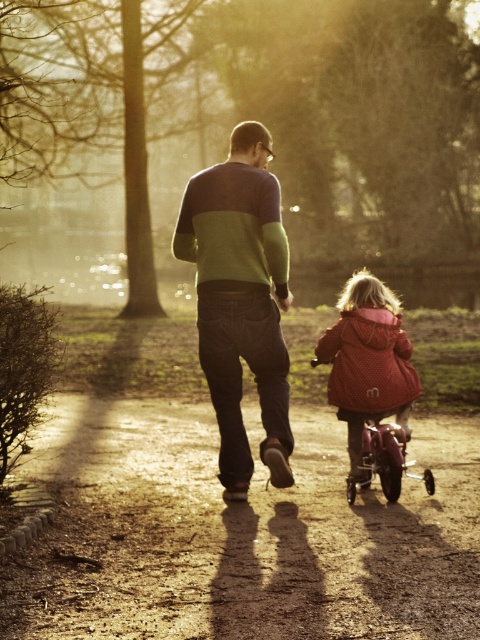
You are standing in the middle of the dirt path and see two points marked on the ground. The first point is at coordinates point (240, 250) and the second point is at point (355, 296). Which point is closer to you?

Point (240, 250) is closer to the viewer than point (355, 296).

You are a parent pushing a metallic pink baby carriage at lower right along the dirt path at center. Can you comfortably walk side by side with another parent pushing a similar carriage on the same path without them overlapping?

The dirt path at center might be wider than metallic pink baby carriage at lower right, but the description does not specify the exact width of the path or the carriage. Without precise measurements, it is uncertain if there is enough space for two carriages side by side.